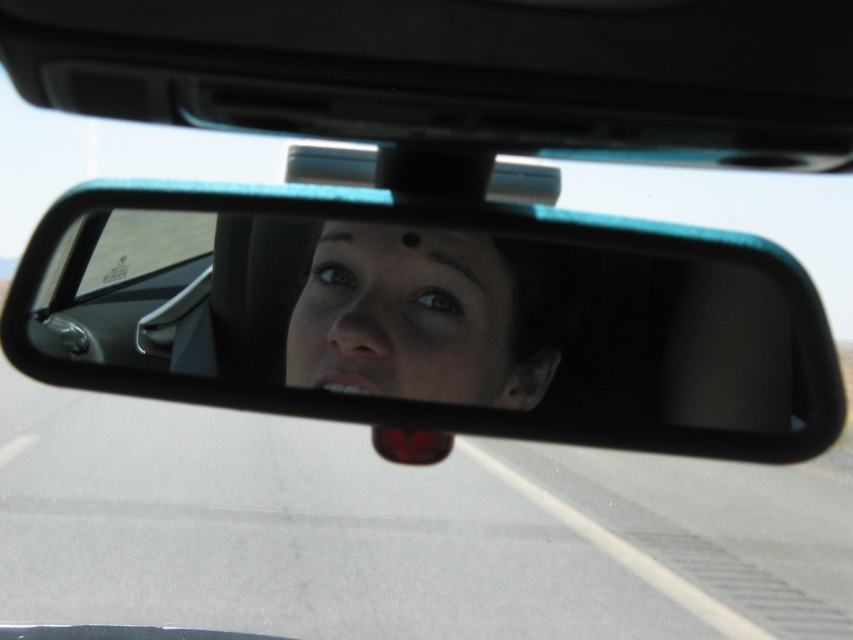
You are a passenger in the car and want to see the face of the driver in the rearview mirror. Can you see the smooth skin face at center reflected in the black plastic mirror at center?

The black plastic mirror at center is in front of the smooth skin face at center, so the smooth skin face at center would be reflected in the mirror. Yes, you can see the smooth skin face at center reflected in the black plastic mirror at center.

You are a passenger in a car and want to adjust the black plastic mirror at center so that you can see the road clearly through the windshield. Based on its current position, is the mirror angled towards the driver or the passenger side?

The black plastic mirror at center is positioned at point (428, 316), which is nearly centered. Therefore, it is likely angled neutrally between the driver and passenger sides, allowing for a balanced view of the road ahead.

You are a passenger in a car and want to check the rearview mirror to see if the driver is looking at the road. The driver is looking upwards as shown in the image. Can you see the driver looking at the road through the black plastic mirror at center and the smooth skin face at center?

The black plastic mirror at center is larger in size than the smooth skin face at center, so the mirror provides a wider view. However, since the driver is looking upwards, their gaze is not directed towards the road. Therefore, you cannot confirm if the driver is looking at the road through the mirror.